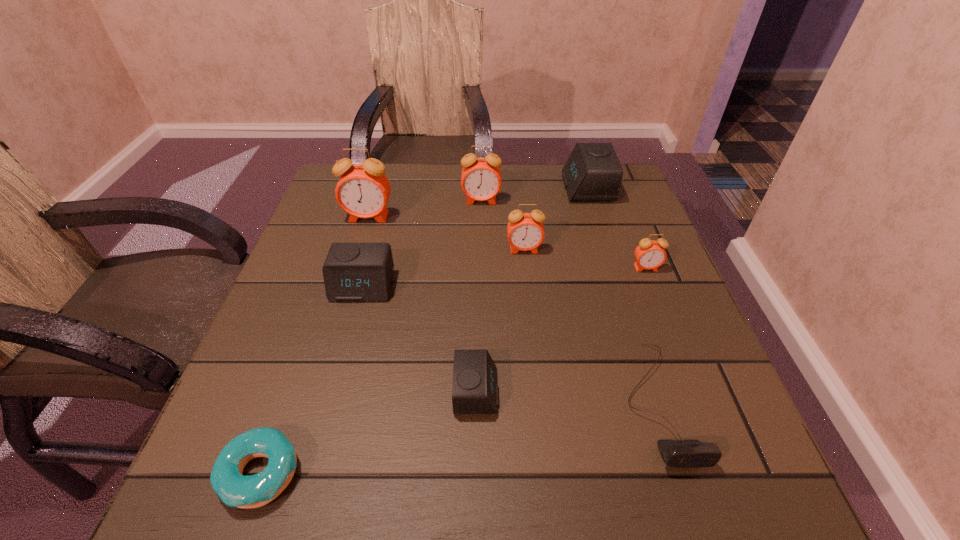
This screenshot has height=540, width=960. In order to click on free spot that satisfies the following two spatial constraints: 1. on the front-facing side of the biggest black alarm clock; 2. on the face of the third pink alarm clock from right to left in this screenshot , I will do `click(591, 200)`.

Where is `free space in the image that satisfies the following two spatial constraints: 1. on the face of the second pink alarm clock from right to left; 2. on the front-facing side of the second black alarm clock from left to right`? free space in the image that satisfies the following two spatial constraints: 1. on the face of the second pink alarm clock from right to left; 2. on the front-facing side of the second black alarm clock from left to right is located at coordinates (540, 392).

This screenshot has width=960, height=540. In order to click on free spot that satisfies the following two spatial constraints: 1. on the face of the second pink alarm clock from left to right; 2. on the front-facing side of the nearest alarm clock in this screenshot , I will do pos(482,392).

This screenshot has width=960, height=540. I want to click on vacant point that satisfies the following two spatial constraints: 1. on the front-facing side of the farthest black alarm clock; 2. on the face of the second smallest pink alarm clock, so click(607, 249).